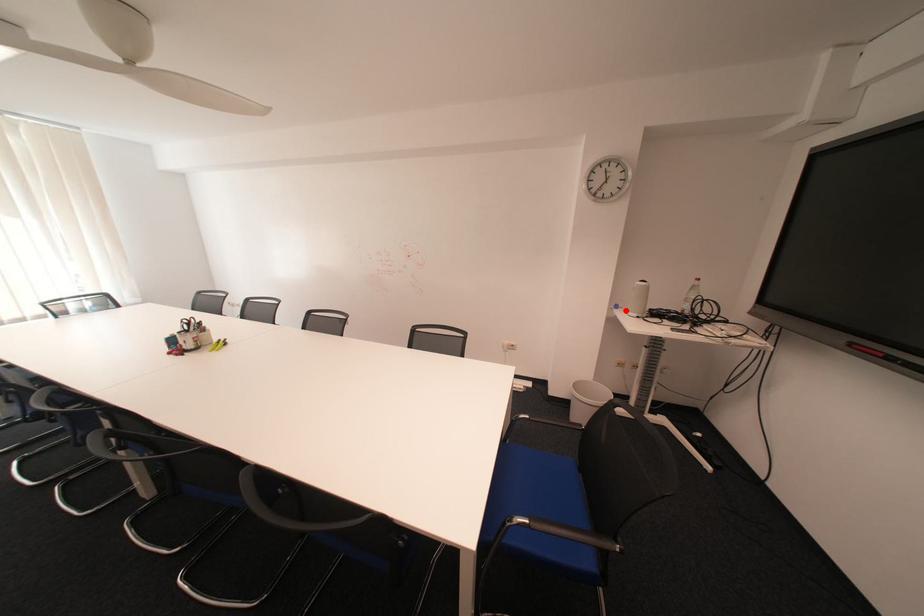
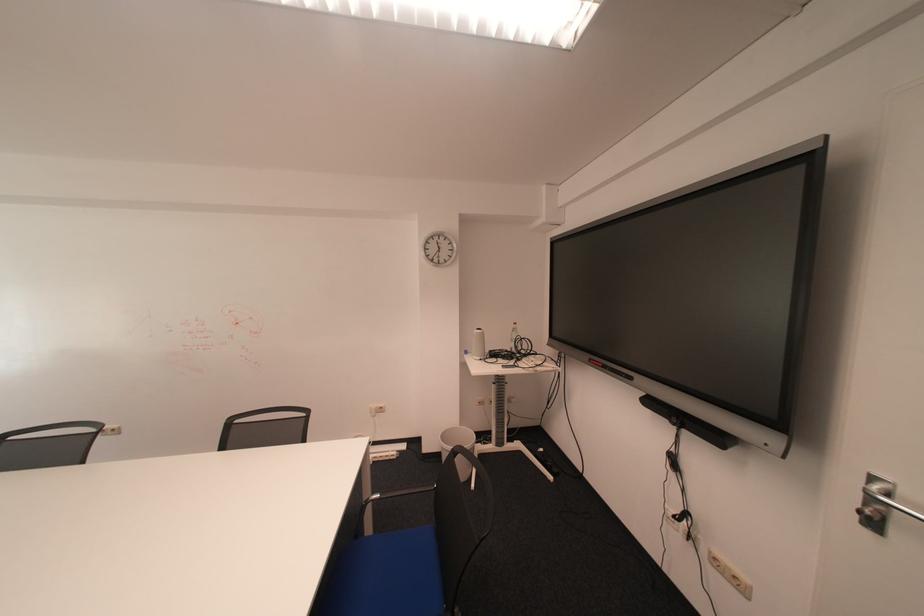
Question: I am providing you with two images of the same scene from different viewpoints. A red point is marked on the first image. Is the red point's position out of view in image 2?

Choices:
 (A) Yes
 (B) No

Answer: (B)